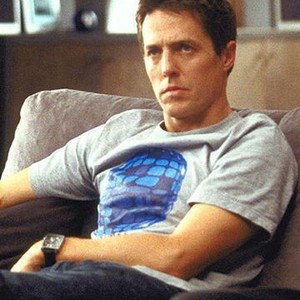
Locate an element on the screen. Image resolution: width=300 pixels, height=300 pixels. brown floor is located at coordinates (253, 77).